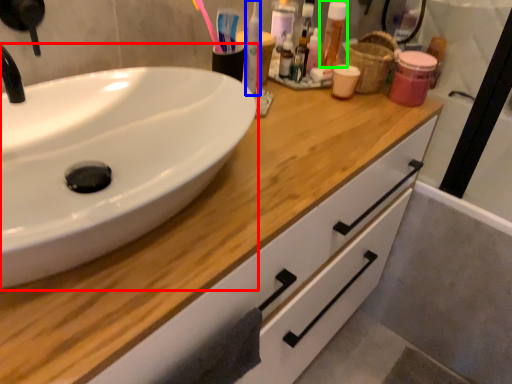
Question: Which object is positioned closest to sink (highlighted by a red box)? Select from mouthwash (highlighted by a blue box) and mouthwash (highlighted by a green box).

Choices:
 (A) mouthwash
 (B) mouthwash

Answer: (A)